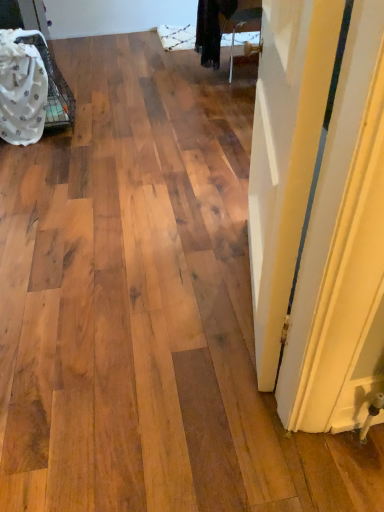
This screenshot has height=512, width=384. What are the coordinates of `vacant space to the left of white painted wood door at right` in the screenshot? It's located at (200, 294).